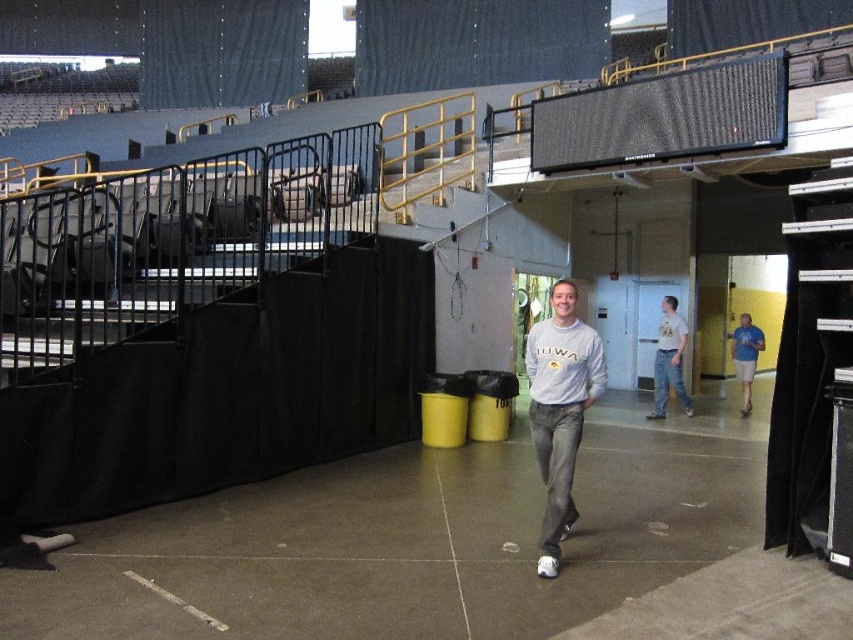
Question: Does gray cotton sweatshirt at center have a greater width compared to white cotton shirt at center?

Choices:
 (A) no
 (B) yes

Answer: (A)

Question: Considering the real-world distances, which object is farthest from the gray cotton sweatshirt at center?

Choices:
 (A) blue fabric shorts at right
 (B) white cotton shirt at center

Answer: (A)

Question: Considering the real-world distances, which object is farthest from the gray cotton sweatshirt at center?

Choices:
 (A) white cotton shirt at center
 (B) blue fabric shorts at right

Answer: (B)

Question: Is gray cotton sweatshirt at center above blue fabric shorts at right?

Choices:
 (A) yes
 (B) no

Answer: (A)

Question: Which object is positioned closest to the blue fabric shorts at right?

Choices:
 (A) white cotton shirt at center
 (B) gray cotton sweatshirt at center

Answer: (A)

Question: Is white cotton shirt at center to the right of blue fabric shorts at right from the viewer's perspective?

Choices:
 (A) yes
 (B) no

Answer: (B)